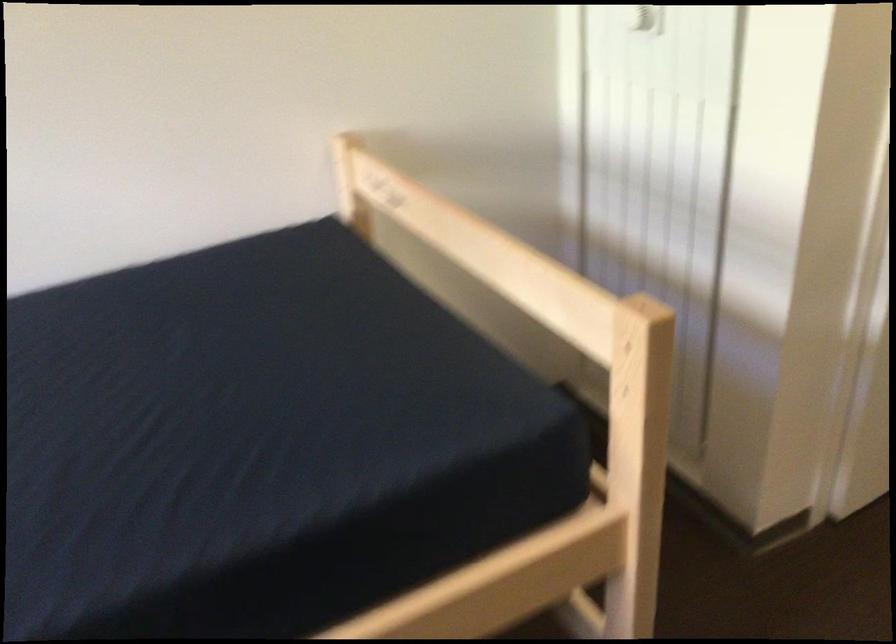
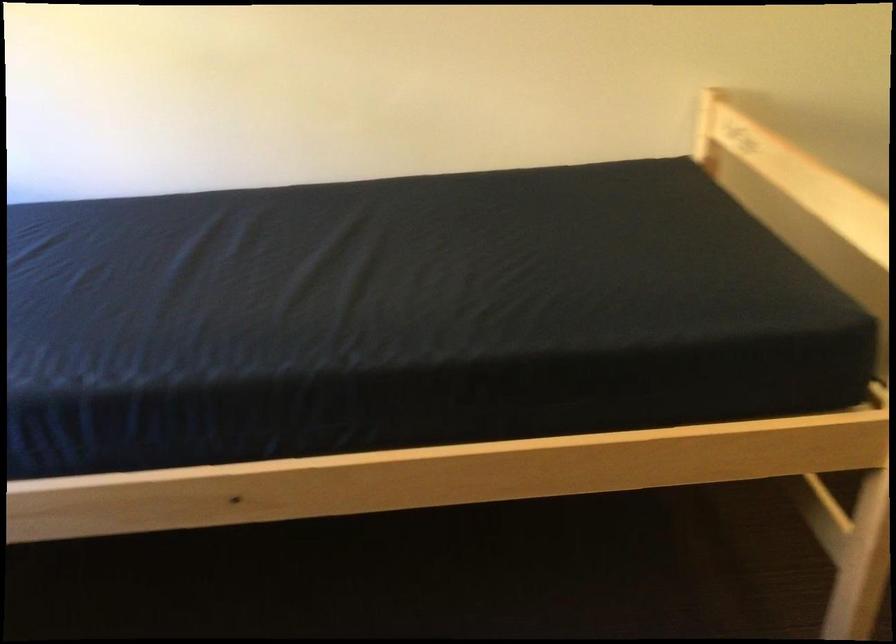
Question: The images are taken continuously from a first-person perspective. In which direction are you moving?

Choices:
 (A) Left
 (B) Right
 (C) Forward
 (D) Backward

Answer: (D)